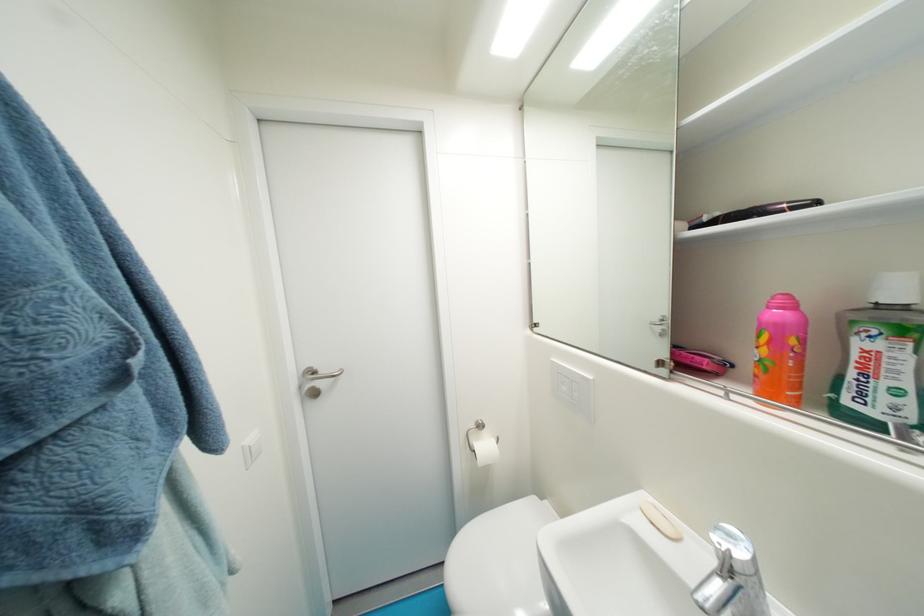
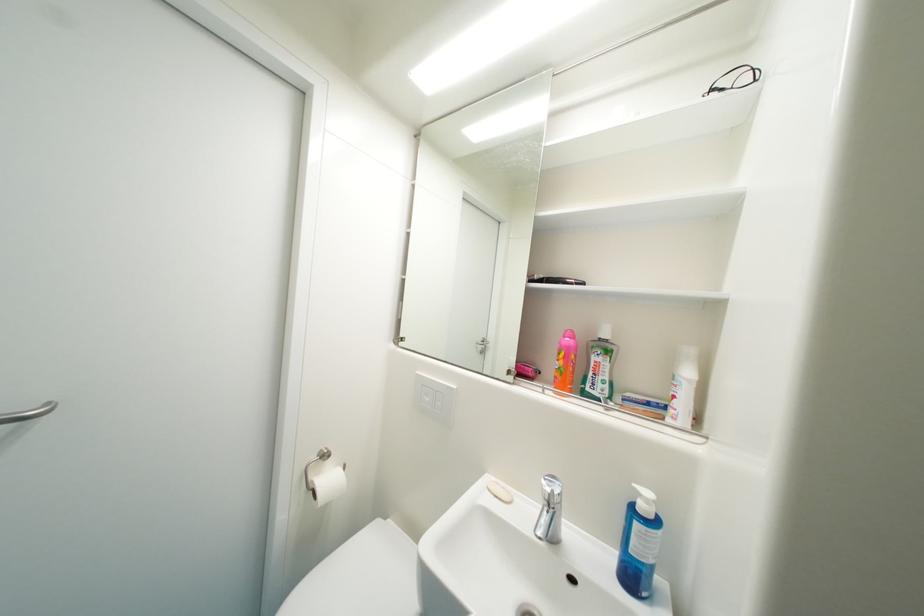
Find the pixel in the second image that matches the point at 542,331 in the first image.

(407, 345)